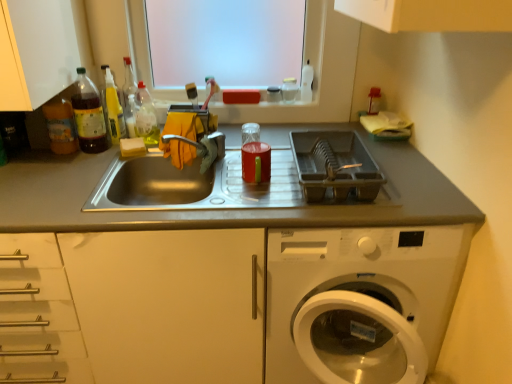
Find the location of `vacant space to the right of translucent plastic bottle at left, the 1th bottle viewed from the left`. vacant space to the right of translucent plastic bottle at left, the 1th bottle viewed from the left is located at coordinates (96, 156).